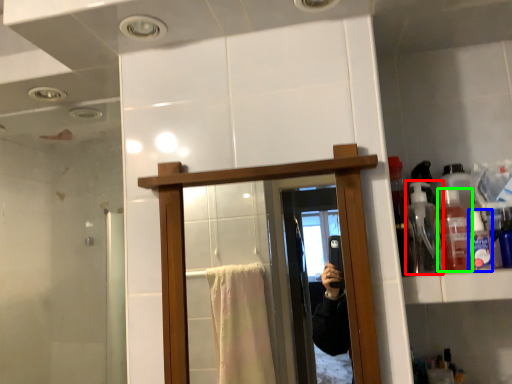
Question: Which is farther away from bottle (highlighted by a red box)? toiletry (highlighted by a blue box) or bottle (highlighted by a green box)?

Choices:
 (A) toiletry
 (B) bottle

Answer: (A)